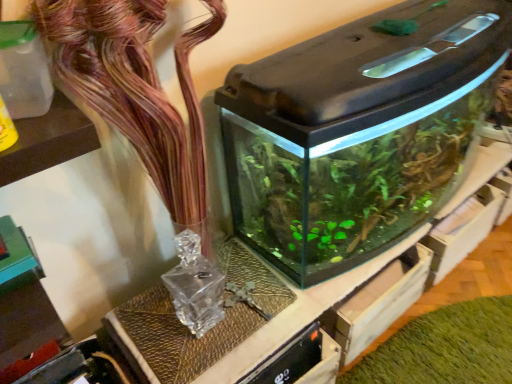
Question: Based on their positions, is transparent glass water tank at center located to the left or right of green matte plant at lower right?

Choices:
 (A) right
 (B) left

Answer: (B)

Question: Is transparent glass water tank at center bigger or smaller than green matte plant at lower right?

Choices:
 (A) small
 (B) big

Answer: (B)

Question: Which object is the closest to the green matte plant at lower right?

Choices:
 (A) transparent glass water tank at center
 (B) translucent glass vase at upper center

Answer: (A)

Question: Which object is the farthest from the green matte plant at lower right?

Choices:
 (A) translucent glass vase at upper center
 (B) transparent glass water tank at center

Answer: (A)